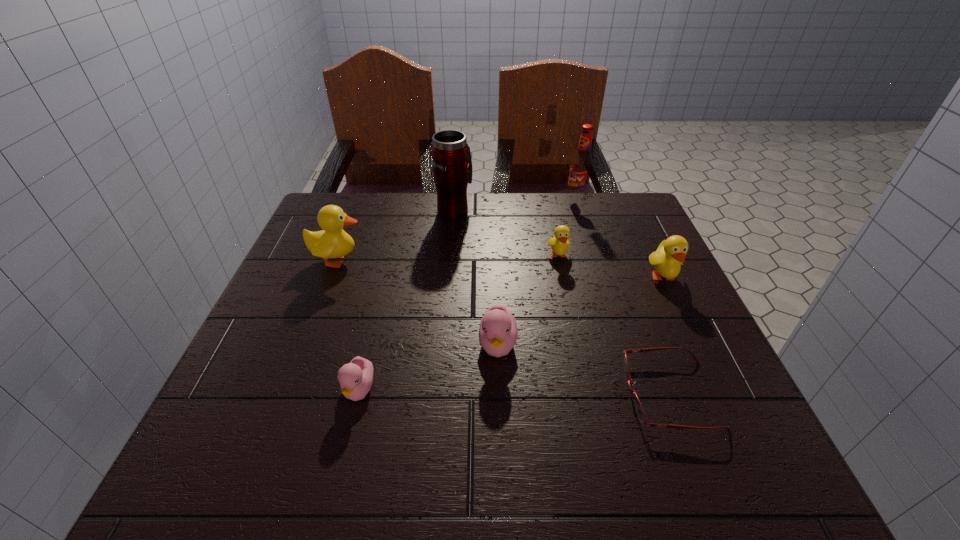
What are the coordinates of `the smallest yellow duckling` in the screenshot? It's located at (559, 243).

At what (x,y) coordinates should I click in order to perform the action: click on the shortest duckling. Please return your answer as a coordinate pair (x, y). Looking at the image, I should click on (356, 377).

This screenshot has width=960, height=540. I want to click on the left pink duckling, so click(x=356, y=377).

Find the location of a particular element. pink spectacles is located at coordinates (639, 410).

Find the location of a particular element. The height and width of the screenshot is (540, 960). the shortest object is located at coordinates (639, 410).

This screenshot has height=540, width=960. In order to click on vacant space situated on the left of the root beer in this screenshot , I will do `click(493, 200)`.

At what (x,y) coordinates should I click in order to perform the action: click on vacant space situated 0.200m on the front-facing side of the leftmost duckling. Please return your answer as a coordinate pair (x, y). The image size is (960, 540). Looking at the image, I should click on (448, 260).

Find the location of `free space located 0.300m on the front-facing side of the second biggest yellow duckling`. free space located 0.300m on the front-facing side of the second biggest yellow duckling is located at coordinates (728, 413).

Locate an element on the screen. free region located 0.120m on the front-facing side of the bigger pink duckling is located at coordinates (501, 429).

The image size is (960, 540). Find the location of `blank space located on the front-facing side of the second yellow duckling from right to left`. blank space located on the front-facing side of the second yellow duckling from right to left is located at coordinates (579, 351).